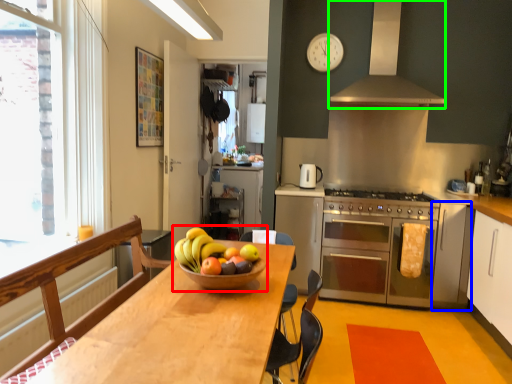
Question: Based on their relative distances, which object is farther from fruit dish (highlighted by a red box)? Choose from cabinetry (highlighted by a blue box) and exhaust hood (highlighted by a green box).

Choices:
 (A) cabinetry
 (B) exhaust hood

Answer: (B)